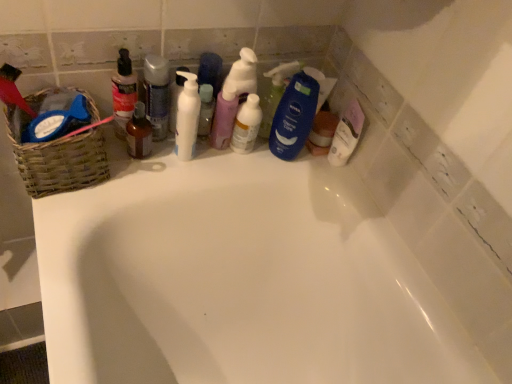
Locate an element on the screen. free space in front of brown glass bottle at center is located at coordinates (100, 197).